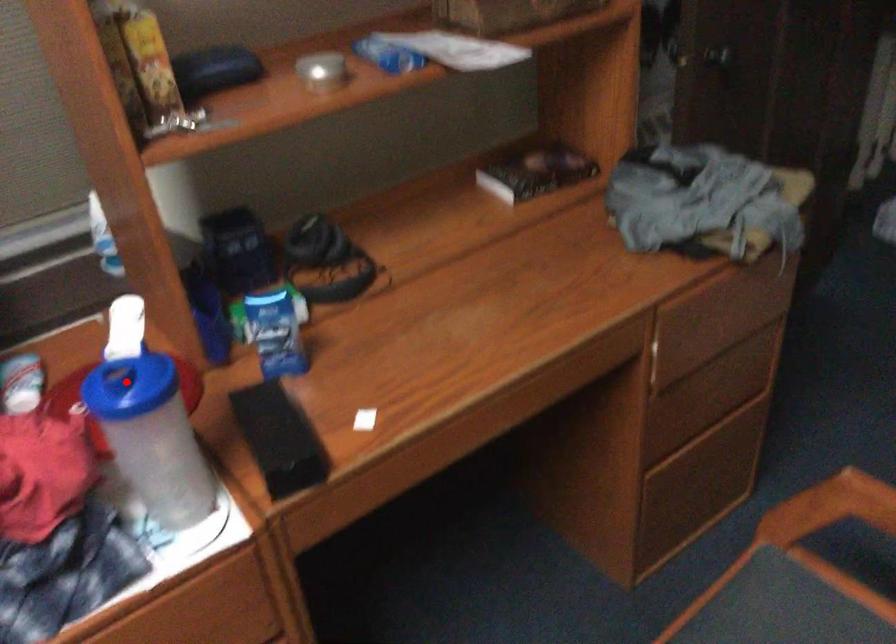
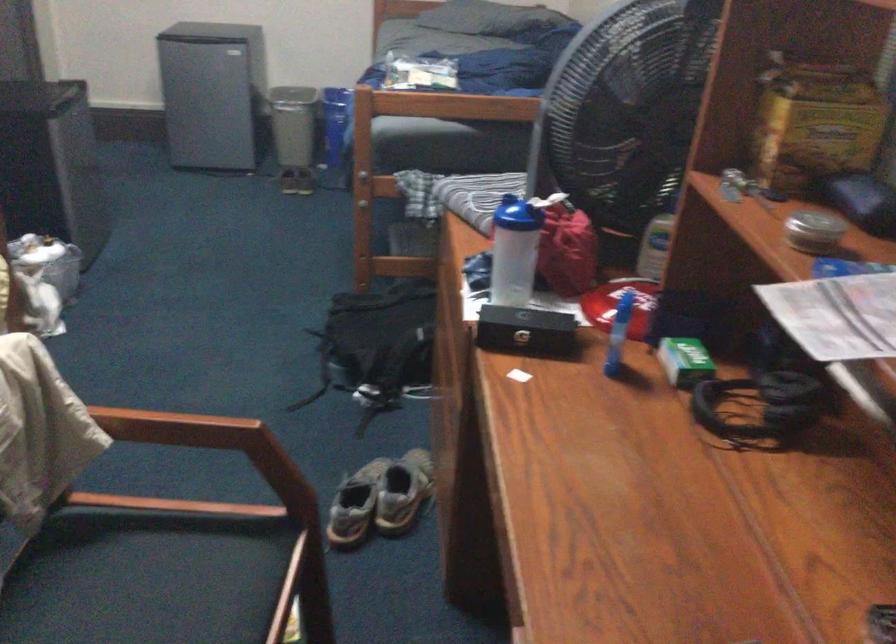
Question: I am providing you with two images of the same scene from different viewpoints. A red point is shown in image1. For the corresponding object point in image2, is it positioned nearer or farther from the camera?

Choices:
 (A) Nearer
 (B) Farther

Answer: (B)